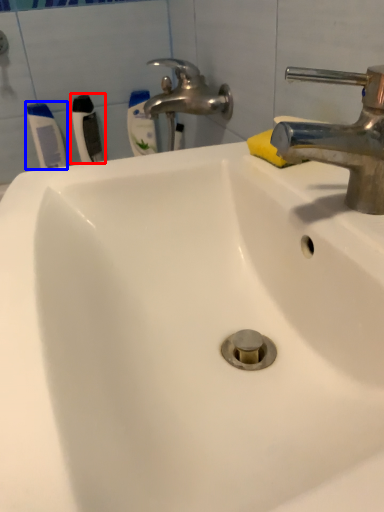
Question: Which object appears closest to the camera in this image, toothbrush (highlighted by a red box) or toothbrush (highlighted by a blue box)?

Choices:
 (A) toothbrush
 (B) toothbrush

Answer: (A)